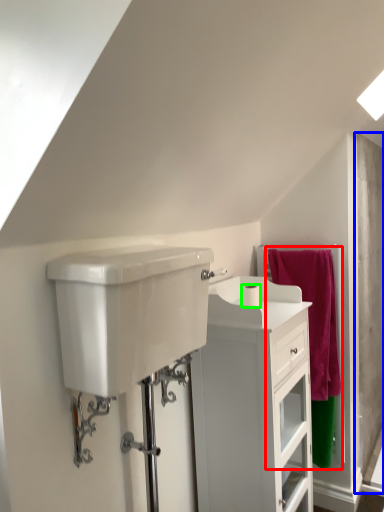
Question: Which object is the closest to the bath towel (highlighted by a red box)? Choose among these: screen door (highlighted by a blue box) or toilet paper (highlighted by a green box).

Choices:
 (A) screen door
 (B) toilet paper

Answer: (A)